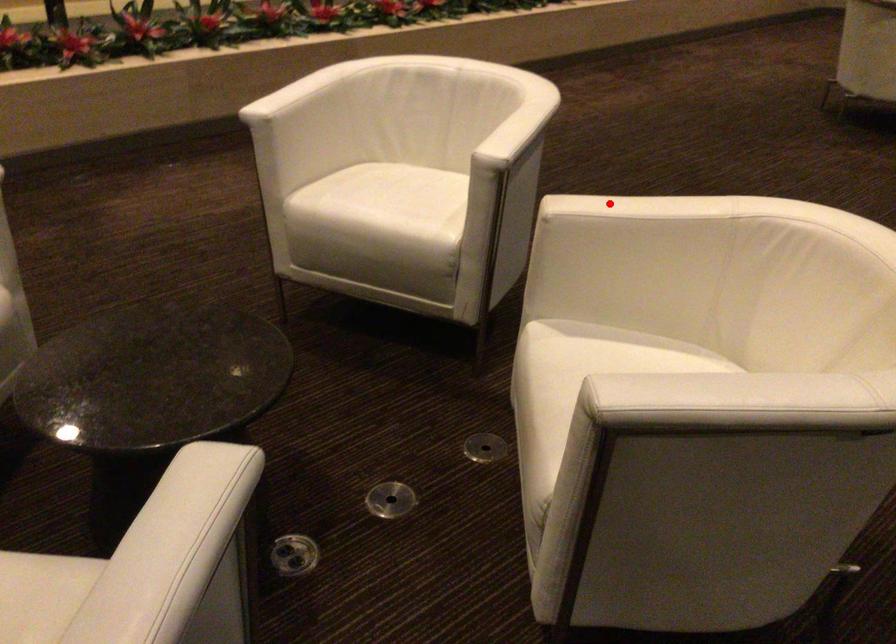
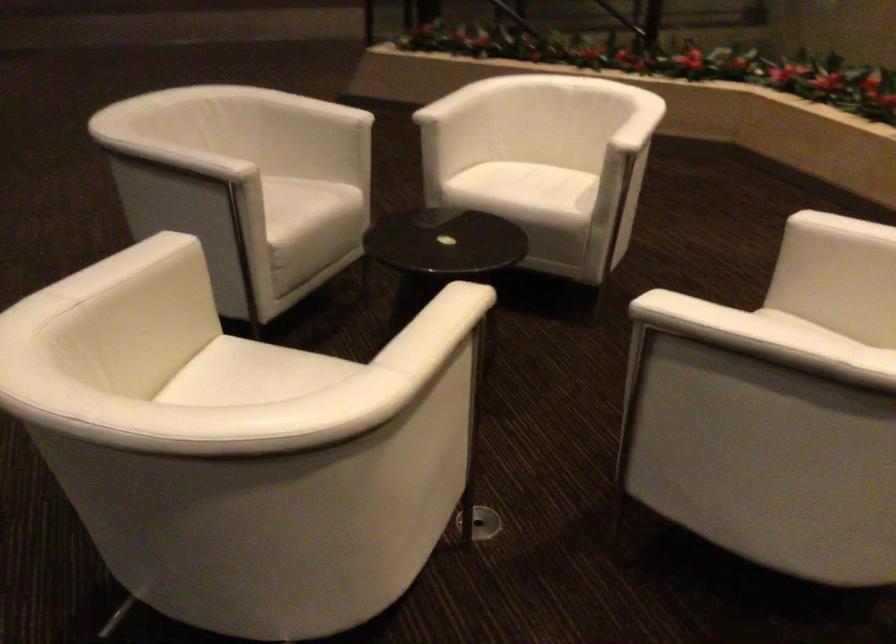
In the second image, find the point that corresponds to the highlighted location in the first image.

(437, 308)